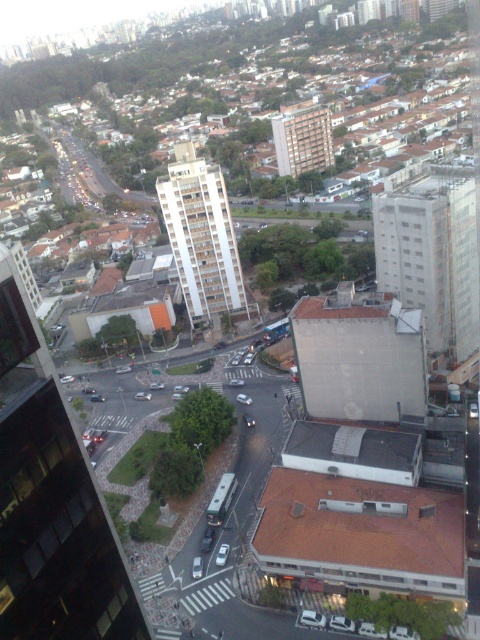
Is white concrete building at center taller than brown brick building at center?

Indeed, white concrete building at center has a greater height compared to brown brick building at center.

Is point (384, 232) closer to camera compared to point (301, 145)?

Yes.

This screenshot has width=480, height=640. In order to click on white concrete building at center in this screenshot , I will do `click(431, 252)`.

Find the location of a particular element. The height and width of the screenshot is (640, 480). white concrete building at center is located at coordinates [431, 252].

Is point (187, 157) positioned after point (304, 125)?

That is False.

Can you confirm if white smooth building at center is thinner than brown brick building at center?

Yes.

Between point (223, 280) and point (294, 150), which one is positioned in front?

Positioned in front is point (223, 280).

At what (x,y) coordinates should I click in order to perform the action: click on white smooth building at center. Please return your answer as a coordinate pair (x, y). Image resolution: width=480 pixels, height=640 pixels. Looking at the image, I should click on (202, 236).

Is point (433, 292) behind point (169, 211)?

No, it is in front of (169, 211).

At what (x,y) coordinates should I click in order to perform the action: click on white concrete building at center. Please return your answer as a coordinate pair (x, y). Looking at the image, I should click on (431, 252).

At what (x,y) coordinates should I click in order to perform the action: click on white concrete building at center. Please return your answer as a coordinate pair (x, y). The width and height of the screenshot is (480, 640). Looking at the image, I should click on (431, 252).